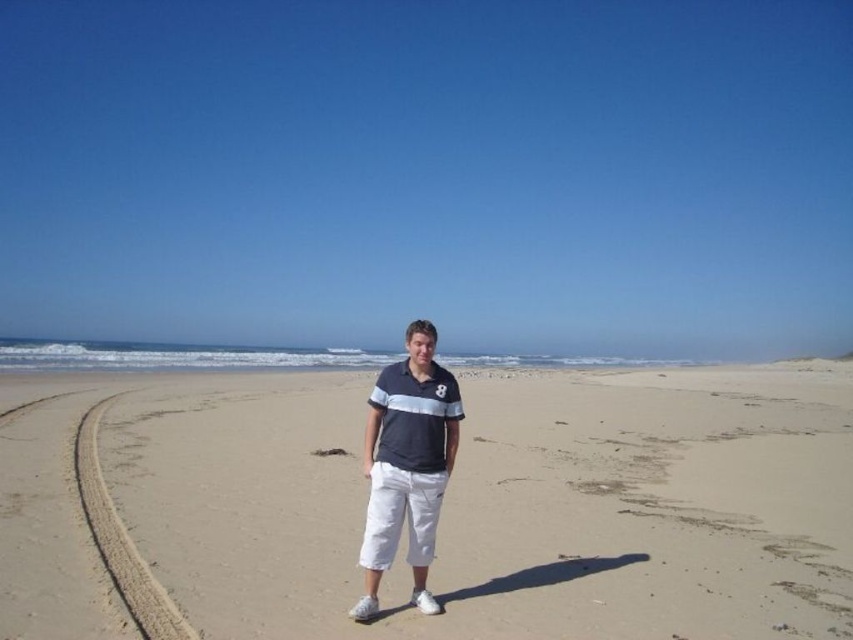
Question: Which point appears closest to the camera in this image?

Choices:
 (A) (407, 464)
 (B) (532, 410)

Answer: (A)

Question: In this image, where is sandy at center located relative to matte blue shirt at center?

Choices:
 (A) above
 (B) below

Answer: (B)

Question: Does sandy at center appear under matte blue shirt at center?

Choices:
 (A) no
 (B) yes

Answer: (B)

Question: Which of the following is the closest to the observer?

Choices:
 (A) matte blue shirt at center
 (B) sandy at center

Answer: (B)

Question: Which point is closer to the camera taking this photo?

Choices:
 (A) (674, 600)
 (B) (436, 404)

Answer: (B)

Question: In this image, where is sandy at center located relative to matte blue shirt at center?

Choices:
 (A) above
 (B) below

Answer: (B)